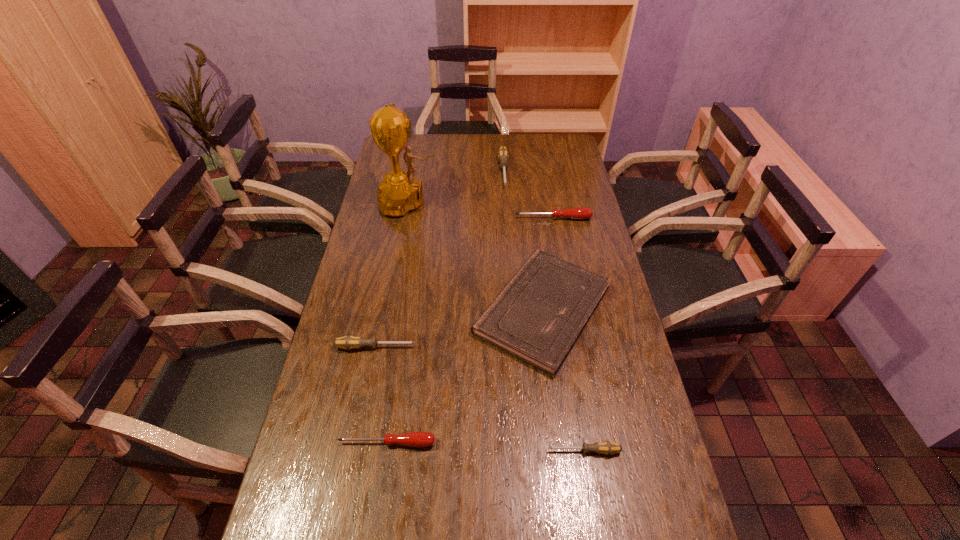
Locate an element on the screen. Image resolution: width=960 pixels, height=540 pixels. the tallest object is located at coordinates (399, 193).

Locate an element on the screen. The image size is (960, 540). award is located at coordinates (399, 193).

Where is `the third screwdriver from left to right`? the third screwdriver from left to right is located at coordinates (503, 154).

The height and width of the screenshot is (540, 960). In order to click on the second gray screwdriver from left to right in this screenshot , I will do `click(503, 154)`.

Find the location of a particular element. The height and width of the screenshot is (540, 960). the right red screwdriver is located at coordinates (579, 213).

At what (x,y) coordinates should I click in order to perform the action: click on the second farthest screwdriver. Please return your answer as a coordinate pair (x, y). Looking at the image, I should click on (579, 213).

Where is `the leftmost gray screwdriver`? This screenshot has height=540, width=960. the leftmost gray screwdriver is located at coordinates [349, 342].

At what (x,y) coordinates should I click in order to perform the action: click on the second smallest gray screwdriver. Please return your answer as a coordinate pair (x, y). The height and width of the screenshot is (540, 960). Looking at the image, I should click on (349, 342).

Image resolution: width=960 pixels, height=540 pixels. I want to click on paperback book, so click(539, 315).

Where is `the nearer red screwdriver`? This screenshot has height=540, width=960. the nearer red screwdriver is located at coordinates (419, 439).